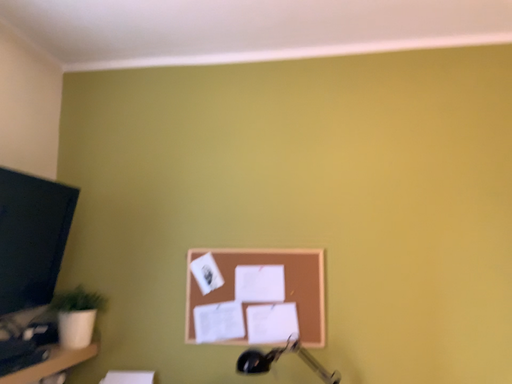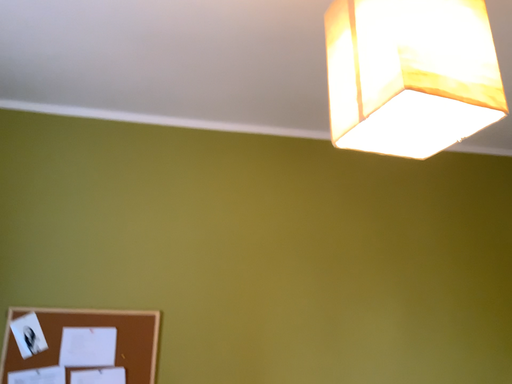
Question: How did the camera likely rotate when shooting the video?

Choices:
 (A) rotated upward
 (B) rotated downward

Answer: (A)